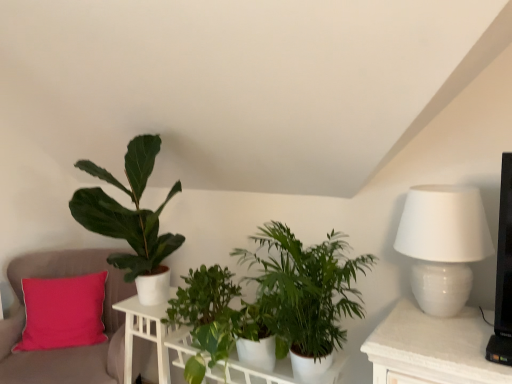
Question: Considering the relative positions of green matte plant at center, marked as the 2th houseplant in a right-to-left arrangement, and white wood table at lower left, which is the 2th table from right to left, in the image provided, is green matte plant at center, marked as the 2th houseplant in a right-to-left arrangement, to the left of white wood table at lower left, which is the 2th table from right to left, from the viewer's perspective?

Choices:
 (A) no
 (B) yes

Answer: (A)

Question: Can you confirm if green matte plant at center, which is the second houseplant from left to right, is taller than white wood table at lower left, which is the 2th table from right to left?

Choices:
 (A) yes
 (B) no

Answer: (B)

Question: Is green matte plant at center, which is the second houseplant from left to right, thinner than white wood table at lower left, which is the 2th table from right to left?

Choices:
 (A) no
 (B) yes

Answer: (A)

Question: Is white wood table at lower left, which is the 2th table from right to left, inside green matte plant at center, which is the second houseplant from left to right?

Choices:
 (A) no
 (B) yes

Answer: (A)

Question: From the image's perspective, is green matte plant at center, which is the second houseplant from left to right, on white wood table at lower left, placed as the first table when sorted from left to right?

Choices:
 (A) no
 (B) yes

Answer: (B)

Question: In the image, is pink fabric cushion at left positioned in front of or behind green matte plant at left, the third houseplant viewed from the right?

Choices:
 (A) behind
 (B) front

Answer: (A)

Question: Considering the positions of point (104, 291) and point (120, 231), is point (104, 291) closer or farther from the camera than point (120, 231)?

Choices:
 (A) closer
 (B) farther

Answer: (B)

Question: From the image's perspective, is pink fabric cushion at left positioned above or below green matte plant at left, the first houseplant from the left?

Choices:
 (A) below
 (B) above

Answer: (A)

Question: Is pink fabric cushion at left to the left or to the right of green matte plant at left, the first houseplant from the left, in the image?

Choices:
 (A) right
 (B) left

Answer: (B)

Question: Is point (x=423, y=292) closer or farther from the camera than point (x=236, y=379)?

Choices:
 (A) closer
 (B) farther

Answer: (A)

Question: Considering the positions of white glossy table lamp at right and white glossy shelf at center in the image, is white glossy table lamp at right taller or shorter than white glossy shelf at center?

Choices:
 (A) tall
 (B) short

Answer: (A)

Question: Considering their positions, is white glossy table lamp at right located in front of or behind white glossy shelf at center?

Choices:
 (A) behind
 (B) front

Answer: (B)

Question: Looking at the image, does white glossy table lamp at right seem bigger or smaller compared to white glossy shelf at center?

Choices:
 (A) big
 (B) small

Answer: (B)

Question: Relative to white glossy table at center, which is the 2th table from left to right, is white glossy shelf at center in front or behind?

Choices:
 (A) behind
 (B) front

Answer: (A)

Question: From a real-world perspective, is white glossy shelf at center positioned above or below white glossy table at center, acting as the 1th table starting from the right?

Choices:
 (A) above
 (B) below

Answer: (B)